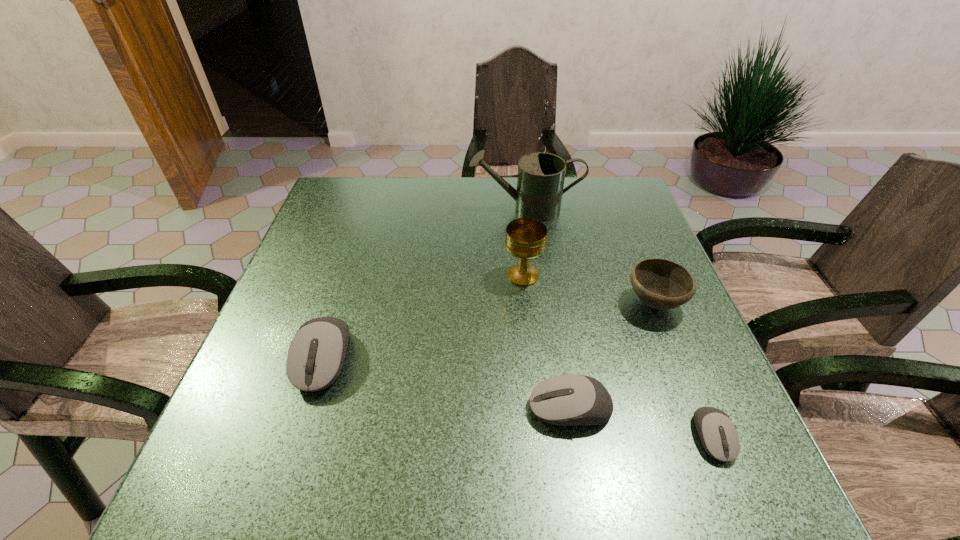
In order to click on computer equipment located at the right edge in this screenshot , I will do `click(718, 435)`.

Find the location of `bowl located in the right edge section of the desktop`. bowl located in the right edge section of the desktop is located at coordinates (662, 284).

At what (x,y) coordinates should I click in order to perform the action: click on object that is at the near left corner. Please return your answer as a coordinate pair (x, y). This screenshot has height=540, width=960. Looking at the image, I should click on (316, 354).

Locate an element on the screen. The image size is (960, 540). object located at the near right corner is located at coordinates (718, 435).

Where is `free space at the far edge of the desktop`? free space at the far edge of the desktop is located at coordinates (468, 193).

I want to click on vacant area at the near edge of the desktop, so click(x=387, y=436).

The image size is (960, 540). In the image, there is a desktop. In order to click on vacant space at the left edge in this screenshot , I will do `click(301, 295)`.

Identify the location of blank area at the right edge. tap(690, 315).

This screenshot has width=960, height=540. In the image, there is a desktop. Find the location of `free space at the far left corner`. free space at the far left corner is located at coordinates pos(372,199).

In order to click on vacant region at the far right corner of the desktop in this screenshot , I will do `click(599, 180)`.